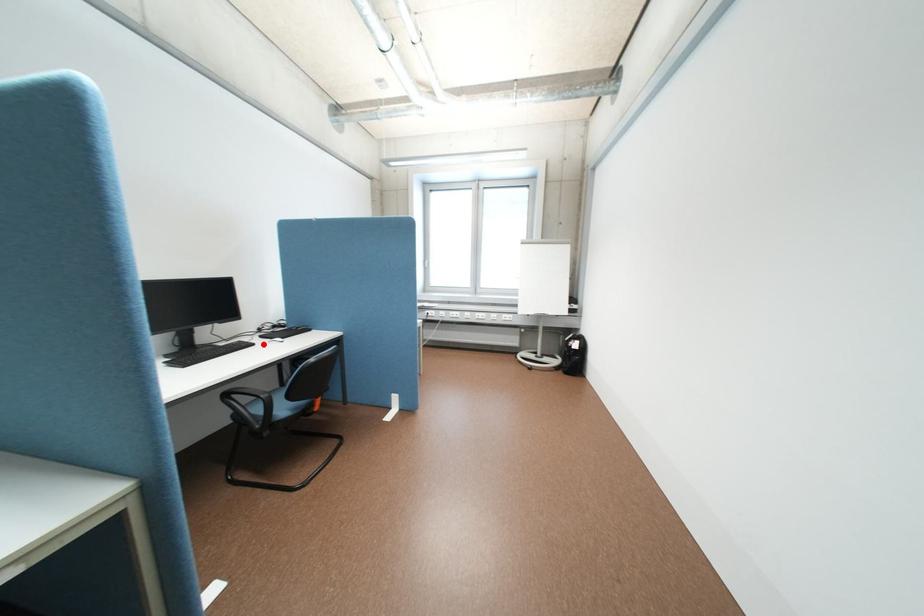
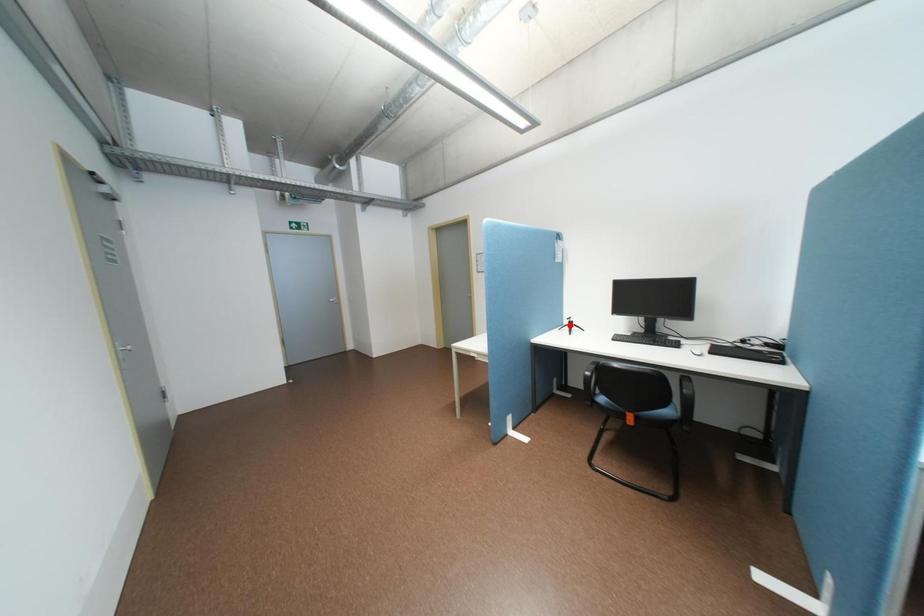
I am providing you with two images of the same scene from different viewpoints. A red point is marked on the first image and another point is marked on the second image. Does the point marked in image1 correspond to the same location as the one in image2?

No